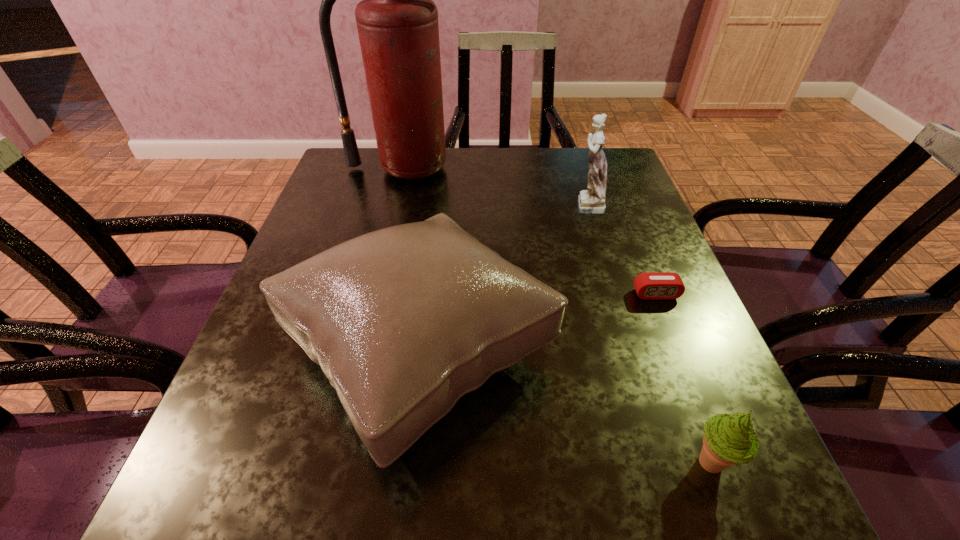
Where is `alarm clock situated at the right edge`? Image resolution: width=960 pixels, height=540 pixels. alarm clock situated at the right edge is located at coordinates point(651,285).

You are a GUI agent. You are given a task and a screenshot of the screen. Output one action in this format:
    pyautogui.click(x=<x>, y=<y>)
    Task: Click on the object that is positioned at the far left corner
    This screenshot has width=960, height=540.
    Given the screenshot: What is the action you would take?
    pyautogui.click(x=397, y=21)

You are a GUI agent. You are given a task and a screenshot of the screen. Output one action in this format:
    pyautogui.click(x=<x>, y=<y>)
    Task: Click on the object that is at the near left corner
    Image resolution: width=960 pixels, height=540 pixels.
    Given the screenshot: What is the action you would take?
    pyautogui.click(x=403, y=321)

The image size is (960, 540). What are the coordinates of `object located at the near right corner` in the screenshot? It's located at (728, 439).

You are a GUI agent. You are given a task and a screenshot of the screen. Output one action in this format:
    pyautogui.click(x=<x>, y=<y>)
    Task: Click on the vacant position at the far edge of the desktop
    This screenshot has height=540, width=960.
    Given the screenshot: What is the action you would take?
    pyautogui.click(x=409, y=186)

Locate an element on the screen. vacant space at the near edge of the desktop is located at coordinates (644, 477).

At what (x,y) coordinates should I click in order to perform the action: click on vacant area at the left edge of the desktop. Please return your answer as a coordinate pair (x, y). The image size is (960, 540). Looking at the image, I should click on (372, 226).

Where is `free space at the right edge`? free space at the right edge is located at coordinates (620, 251).

Where is `free space at the far left corner of the desktop`? The image size is (960, 540). free space at the far left corner of the desktop is located at coordinates (343, 153).

You are a GUI agent. You are given a task and a screenshot of the screen. Output one action in this format:
    pyautogui.click(x=<x>, y=<y>)
    Task: Click on the vacant area that lies between the alarm clock and the figurine
    The width and height of the screenshot is (960, 540).
    Given the screenshot: What is the action you would take?
    pyautogui.click(x=621, y=249)